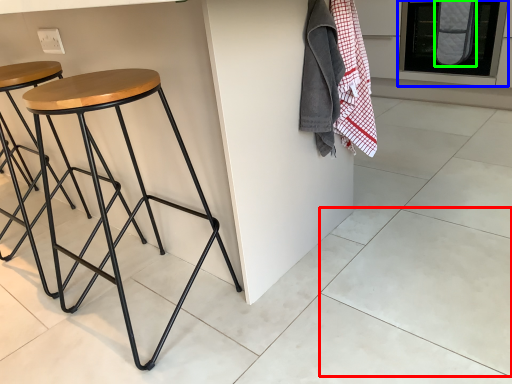
Question: Based on their relative distances, which object is farther from tile (highlighted by a red box)? Choose from oven (highlighted by a blue box) and blanket (highlighted by a green box).

Choices:
 (A) oven
 (B) blanket

Answer: (A)